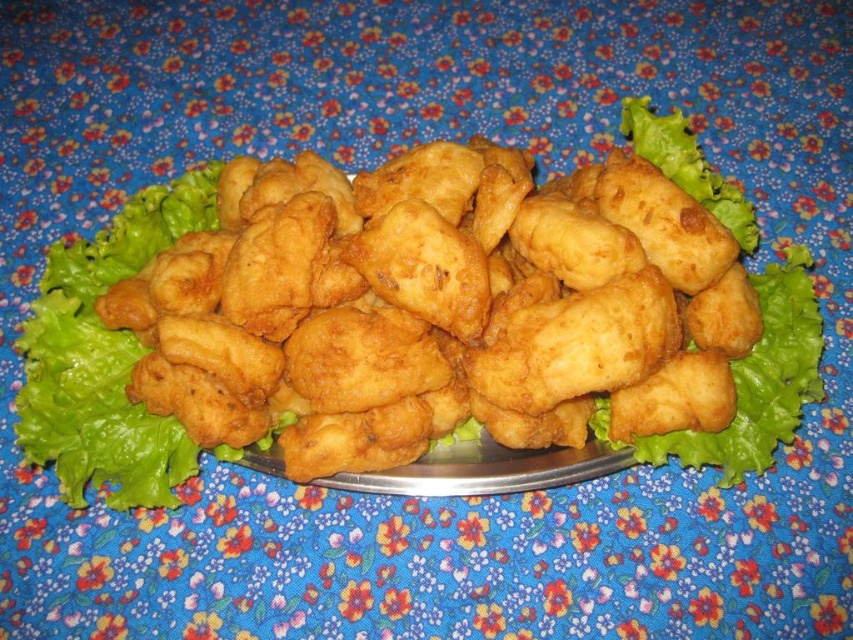
Does golden fried nugget at center appear under green leafy lettuce at center?

Yes.

Who is positioned more to the right, golden fried nugget at center or green leafy lettuce at center?

golden fried nugget at center

Does point (625, 276) lie in front of point (57, 420)?

Yes, it is.

You are a GUI agent. You are given a task and a screenshot of the screen. Output one action in this format:
    pyautogui.click(x=<x>, y=<y>)
    Task: Click on the golden fried nugget at center
    The image size is (853, 640).
    Given the screenshot: What is the action you would take?
    pyautogui.click(x=439, y=307)